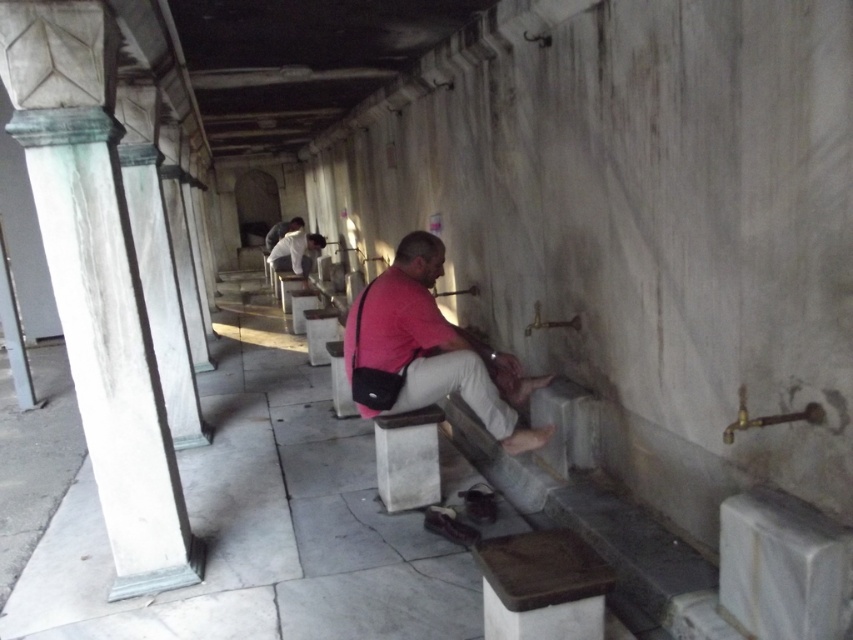
Question: Estimate the real-world distances between objects in this image. Which object is closer to the matte pink shirt at center?

Choices:
 (A) white marble stool at lower center
 (B) white shirt at center
 (C) pink matte shirt at center

Answer: (B)

Question: Can you confirm if white shirt at center is positioned to the left of matte pink shirt at center?

Choices:
 (A) yes
 (B) no

Answer: (B)

Question: Can you confirm if pink matte shirt at center is wider than white shirt at center?

Choices:
 (A) yes
 (B) no

Answer: (A)

Question: Is white shirt at center positioned behind matte pink shirt at center?

Choices:
 (A) yes
 (B) no

Answer: (B)

Question: Which point is farther to the camera?

Choices:
 (A) (488, 353)
 (B) (296, 240)
 (C) (289, 225)

Answer: (C)

Question: Among these points, which one is nearest to the camera?

Choices:
 (A) (281, 224)
 (B) (430, 241)
 (C) (422, 445)

Answer: (B)